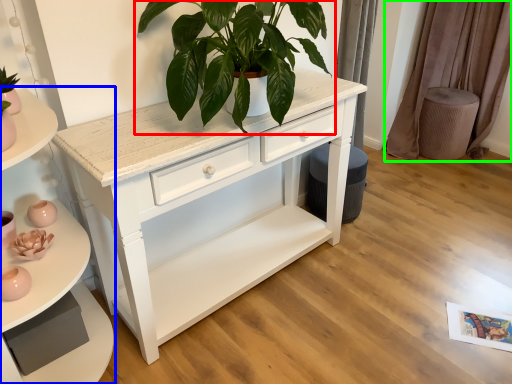
Question: Which object is positioned closest to houseplant (highlighted by a red box)? Select from shelf (highlighted by a blue box) and curtain (highlighted by a green box).

Choices:
 (A) shelf
 (B) curtain

Answer: (A)